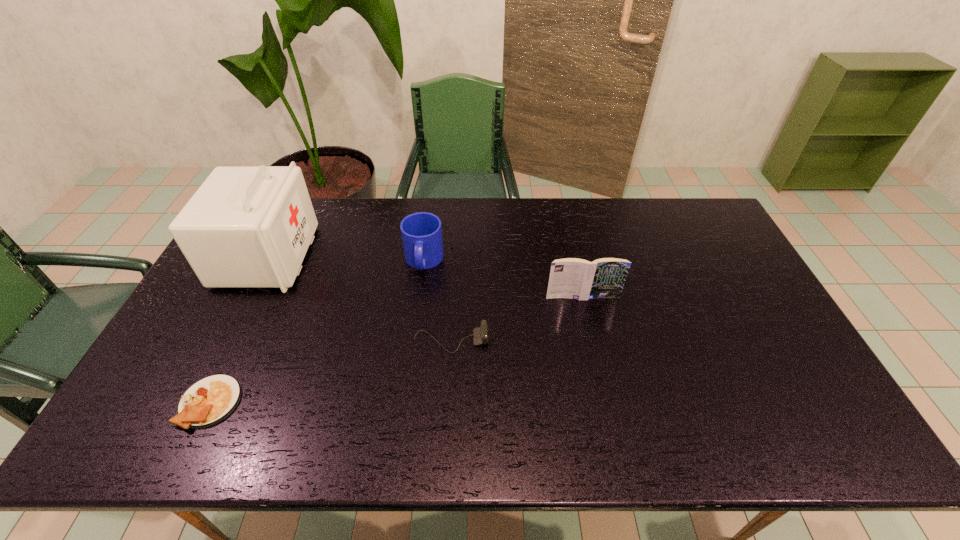
This screenshot has width=960, height=540. I want to click on free spot located on the front-facing side of the webcam, so click(543, 341).

Locate an element on the screen. The image size is (960, 540). vacant space situated 0.230m on the right of the shortest object is located at coordinates (333, 403).

The width and height of the screenshot is (960, 540). I want to click on object that is at the far edge, so click(x=246, y=226).

The height and width of the screenshot is (540, 960). In order to click on object that is at the near edge in this screenshot , I will do `click(210, 400)`.

This screenshot has width=960, height=540. I want to click on the first-aid kit that is at the left edge, so click(246, 226).

Where is `omelet that is at the left edge`? This screenshot has height=540, width=960. omelet that is at the left edge is located at coordinates (210, 400).

This screenshot has height=540, width=960. I want to click on object at the far left corner, so click(x=246, y=226).

You are a GUI agent. You are given a task and a screenshot of the screen. Output one action in this format:
    pyautogui.click(x=<x>, y=<y>)
    Task: Click on the object that is at the near left corner
    The height and width of the screenshot is (540, 960).
    Given the screenshot: What is the action you would take?
    pyautogui.click(x=210, y=400)

Where is `vacant area at the far edge`? Image resolution: width=960 pixels, height=540 pixels. vacant area at the far edge is located at coordinates (469, 210).

This screenshot has height=540, width=960. Identify the location of free location at the near edge. (720, 426).